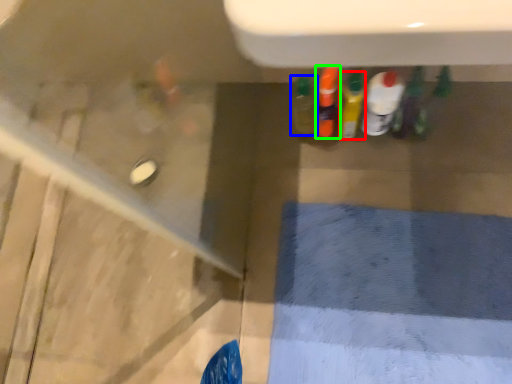
Question: Based on their relative distances, which object is farther from bottle (highlighted by a red box)? Choose from bottle (highlighted by a blue box) and bottle (highlighted by a green box).

Choices:
 (A) bottle
 (B) bottle

Answer: (A)